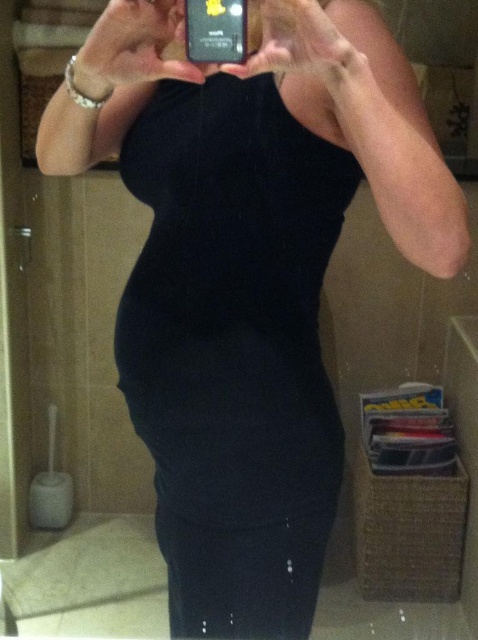
Can you confirm if black velvet dress at center is positioned above black plastic phone at upper center?

No.

Locate an element on the screen. Image resolution: width=478 pixels, height=640 pixels. black velvet dress at center is located at coordinates (234, 349).